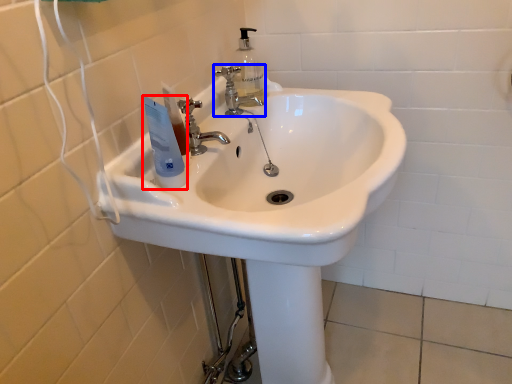
Question: Which object is further to the camera taking this photo, mouthwash (highlighted by a red box) or tap (highlighted by a blue box)?

Choices:
 (A) mouthwash
 (B) tap

Answer: (B)